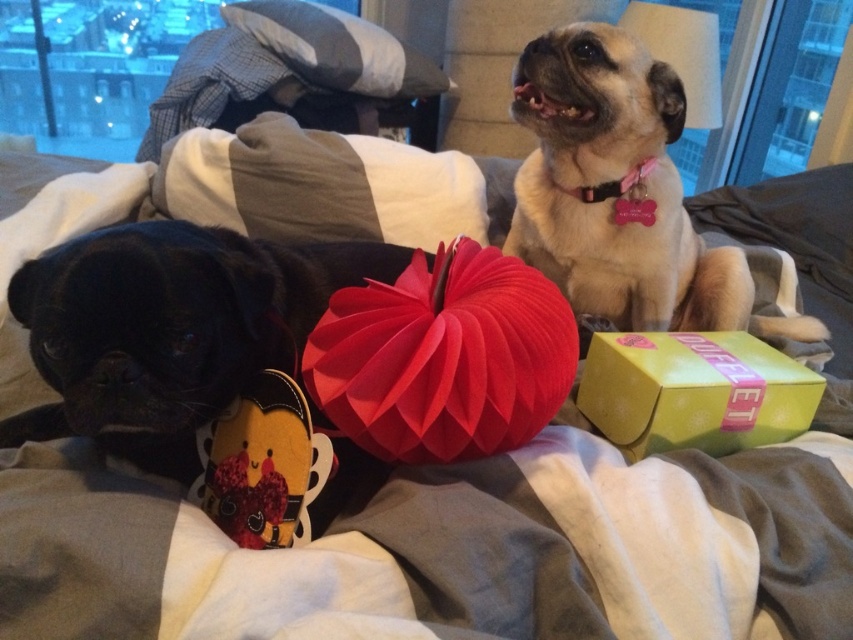
Question: Where is green matte gift box at center right located in relation to gray/white striped pillow at upper center in the image?

Choices:
 (A) right
 (B) left

Answer: (A)

Question: Which point is closer to the camera?

Choices:
 (A) velvety plush heart at lower left
 (B) green matte gift box at center right
 (C) light brown fur at upper right

Answer: (A)

Question: Where is light brown fur at upper right located in relation to green matte gift box at center right in the image?

Choices:
 (A) left
 (B) right

Answer: (B)

Question: Which point is closer to the camera?

Choices:
 (A) click(294, 500)
 (B) click(741, 387)

Answer: (A)

Question: Based on their relative distances, which object is farther from the white soft pillow at center?

Choices:
 (A) green matte gift box at center right
 (B) velvety plush heart at lower left
 (C) light brown fur at upper right
 (D) gray/white striped pillow at upper center

Answer: (D)

Question: Is light brown fur at upper right to the left of green matte gift box at center right from the viewer's perspective?

Choices:
 (A) yes
 (B) no

Answer: (B)